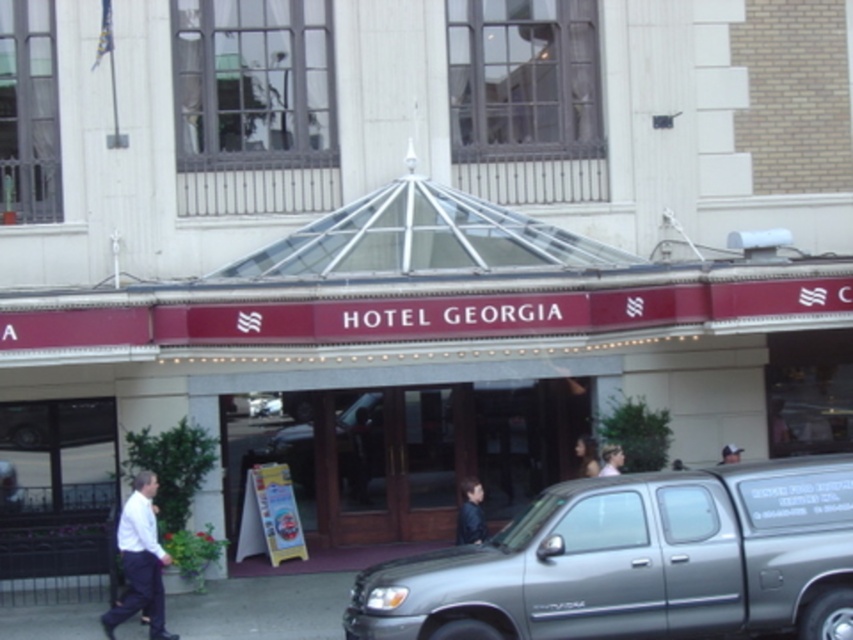
Question: Which point appears closest to the camera in this image?

Choices:
 (A) (602, 468)
 (B) (595, 461)

Answer: (A)

Question: Is silver metallic minivan at center positioned behind smooth brown hair at center?

Choices:
 (A) no
 (B) yes

Answer: (A)

Question: Is white smooth shirt at lower left further to the viewer compared to smooth brown hair at center?

Choices:
 (A) yes
 (B) no

Answer: (B)

Question: Considering the real-world distances, which object is closest to the dark blue shirt at center?

Choices:
 (A) silver metallic minivan at center
 (B) smooth brown hair at center
 (C) white smooth shirt at lower left

Answer: (A)

Question: Which is nearer to the smooth brown hair at center?

Choices:
 (A) dark blue shirt at center
 (B) silver metallic minivan at center
 (C) white smooth shirt at lower left

Answer: (A)

Question: Is maroon signboard at center to the left of white smooth shirt at lower left from the viewer's perspective?

Choices:
 (A) no
 (B) yes

Answer: (A)